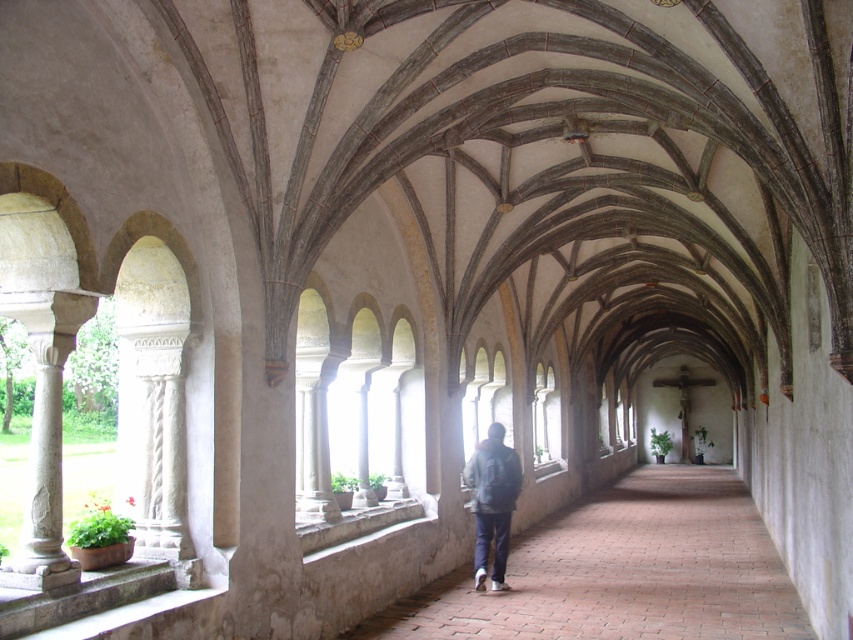
Question: Does brown brick path at center appear over dark blue denim jacket at center?

Choices:
 (A) yes
 (B) no

Answer: (B)

Question: Considering the relative positions of brown brick path at center and dark blue denim jacket at center in the image provided, where is brown brick path at center located with respect to dark blue denim jacket at center?

Choices:
 (A) above
 (B) below

Answer: (B)

Question: Which point appears closest to the camera in this image?

Choices:
 (A) (485, 509)
 (B) (596, 538)

Answer: (A)

Question: Which point is closer to the camera?

Choices:
 (A) (503, 557)
 (B) (564, 544)

Answer: (A)

Question: Which point is closer to the camera?

Choices:
 (A) brown brick path at center
 (B) dark blue denim jacket at center

Answer: (A)

Question: Can you confirm if brown brick path at center is thinner than dark blue denim jacket at center?

Choices:
 (A) no
 (B) yes

Answer: (A)